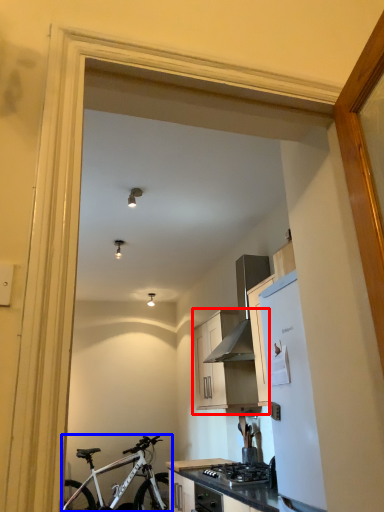
Question: Among these objects, which one is farthest to the camera, cabinetry (highlighted by a red box) or bicycle (highlighted by a blue box)?

Choices:
 (A) cabinetry
 (B) bicycle

Answer: (B)